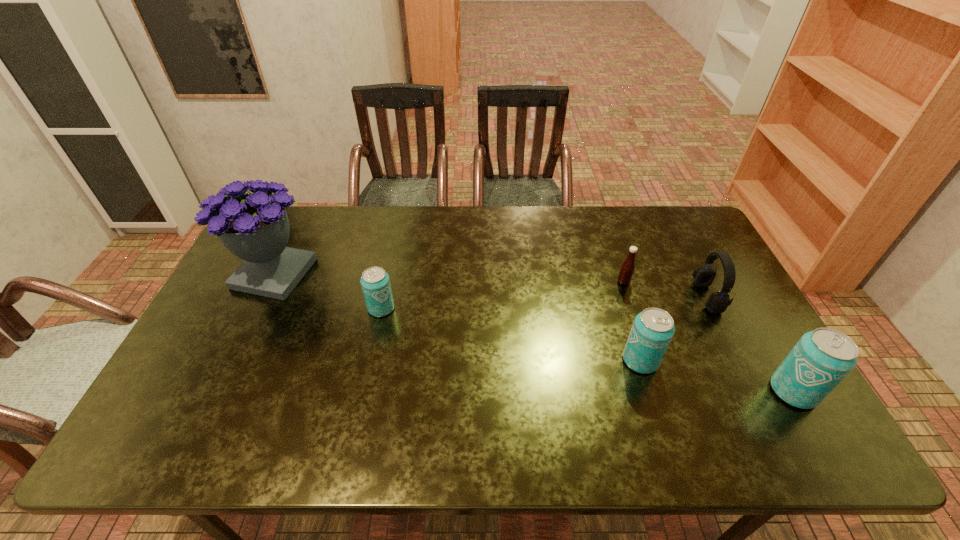
The height and width of the screenshot is (540, 960). In order to click on the leftmost beer can in this screenshot , I will do `click(375, 282)`.

Where is `the shortest beer can`? The image size is (960, 540). the shortest beer can is located at coordinates (375, 282).

Find the location of a particular element. the second beer can from left to right is located at coordinates pyautogui.click(x=653, y=329).

Where is `the rightmost object`? The height and width of the screenshot is (540, 960). the rightmost object is located at coordinates (821, 359).

Identify the location of the fifth object from left to right. (717, 302).

Image resolution: width=960 pixels, height=540 pixels. What are the coordinates of `the tallest object` in the screenshot? It's located at (255, 227).

The height and width of the screenshot is (540, 960). I want to click on the leftmost object, so click(255, 227).

This screenshot has width=960, height=540. Identify the location of Tabasco sauce. (627, 268).

Where is `vacant point located on the left of the fifth object from right to left`? The width and height of the screenshot is (960, 540). vacant point located on the left of the fifth object from right to left is located at coordinates (259, 308).

You are a GUI agent. You are given a task and a screenshot of the screen. Output one action in this format:
    pyautogui.click(x=<x>, y=<y>)
    Task: Click on the vacant space situated on the left of the second tallest beer can
    This screenshot has width=960, height=540.
    Given the screenshot: What is the action you would take?
    pyautogui.click(x=471, y=360)